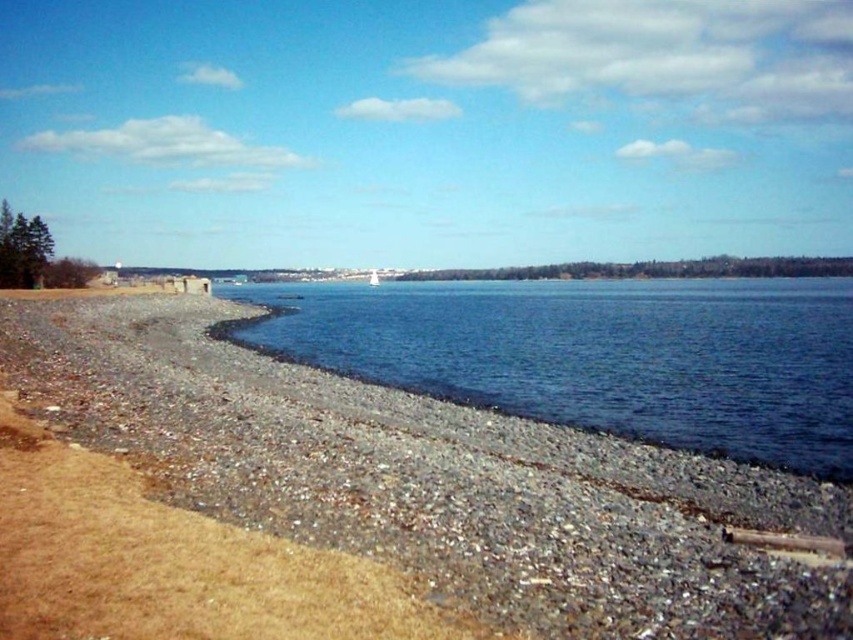
Question: Among these objects, which one is farthest from the camera?

Choices:
 (A) gravelly sand beach at lower left
 (B) blue water at center

Answer: (B)

Question: Considering the relative positions of gravelly sand beach at lower left and blue water at center in the image provided, where is gravelly sand beach at lower left located with respect to blue water at center?

Choices:
 (A) right
 (B) left

Answer: (B)

Question: Among these points, which one is farthest from the camera?

Choices:
 (A) (497, 416)
 (B) (293, 308)

Answer: (B)

Question: Is gravelly sand beach at lower left closer to camera compared to blue water at center?

Choices:
 (A) yes
 (B) no

Answer: (A)

Question: In this image, where is gravelly sand beach at lower left located relative to blue water at center?

Choices:
 (A) right
 (B) left

Answer: (B)